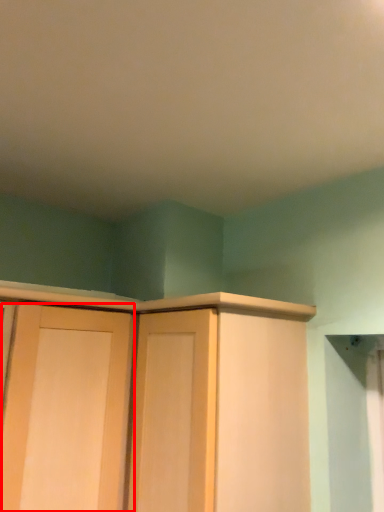
Question: Observing the image, what is the correct spatial positioning of door (annotated by the red box) in reference to cupboard?

Choices:
 (A) left
 (B) right

Answer: (A)